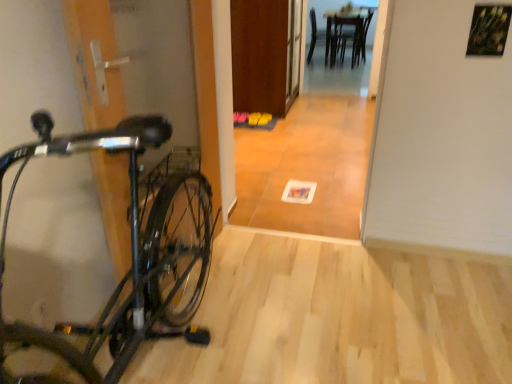
Question: Is wooden table at center not inside shiny black bicycle at left?

Choices:
 (A) yes
 (B) no

Answer: (A)

Question: From the image's perspective, is wooden table at center under shiny black bicycle at left?

Choices:
 (A) yes
 (B) no

Answer: (B)

Question: Is wooden table at center further to the viewer compared to shiny black bicycle at left?

Choices:
 (A) yes
 (B) no

Answer: (A)

Question: Is shiny black bicycle at left inside wooden table at center?

Choices:
 (A) no
 (B) yes

Answer: (A)

Question: Are wooden table at center and shiny black bicycle at left far apart?

Choices:
 (A) yes
 (B) no

Answer: (A)

Question: From the image's perspective, is wooden door at center above or below wooden chair at center?

Choices:
 (A) below
 (B) above

Answer: (A)

Question: In terms of size, does wooden door at center appear bigger or smaller than wooden chair at center?

Choices:
 (A) big
 (B) small

Answer: (A)

Question: Is wooden door at center inside the boundaries of wooden chair at center, or outside?

Choices:
 (A) outside
 (B) inside

Answer: (A)

Question: From their relative heights in the image, would you say wooden door at center is taller or shorter than wooden chair at center?

Choices:
 (A) tall
 (B) short

Answer: (A)

Question: Is shiny black bicycle at left bigger or smaller than wooden table at center?

Choices:
 (A) big
 (B) small

Answer: (A)

Question: Based on their positions, is shiny black bicycle at left located to the left or right of wooden table at center?

Choices:
 (A) right
 (B) left

Answer: (B)

Question: Is shiny black bicycle at left situated inside wooden table at center or outside?

Choices:
 (A) inside
 (B) outside

Answer: (B)

Question: Does point (31, 382) appear closer or farther from the camera than point (342, 41)?

Choices:
 (A) closer
 (B) farther

Answer: (A)

Question: From a real-world perspective, is wooden table at center physically located above or below wooden floor at center?

Choices:
 (A) above
 (B) below

Answer: (B)

Question: Relative to wooden floor at center, is wooden table at center in front or behind?

Choices:
 (A) front
 (B) behind

Answer: (B)